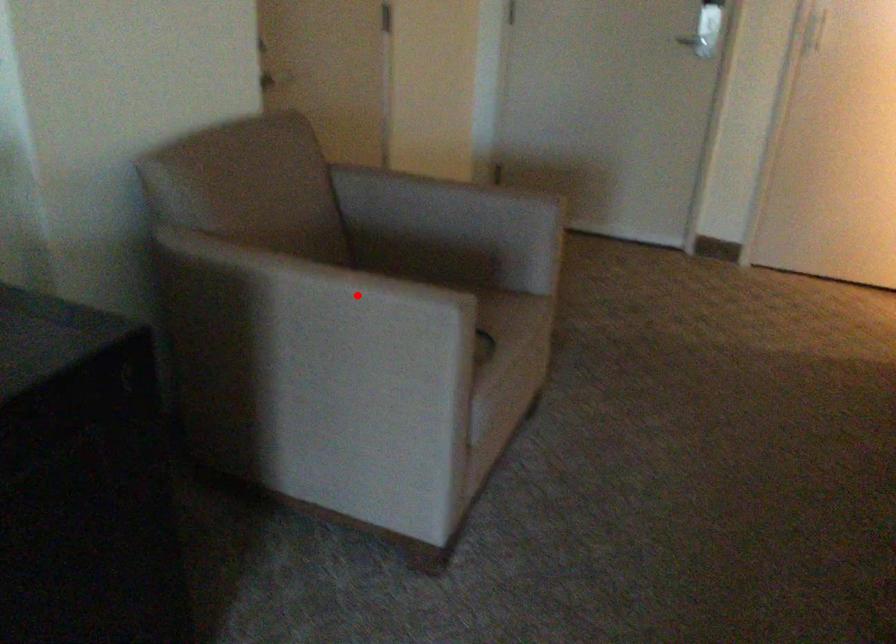
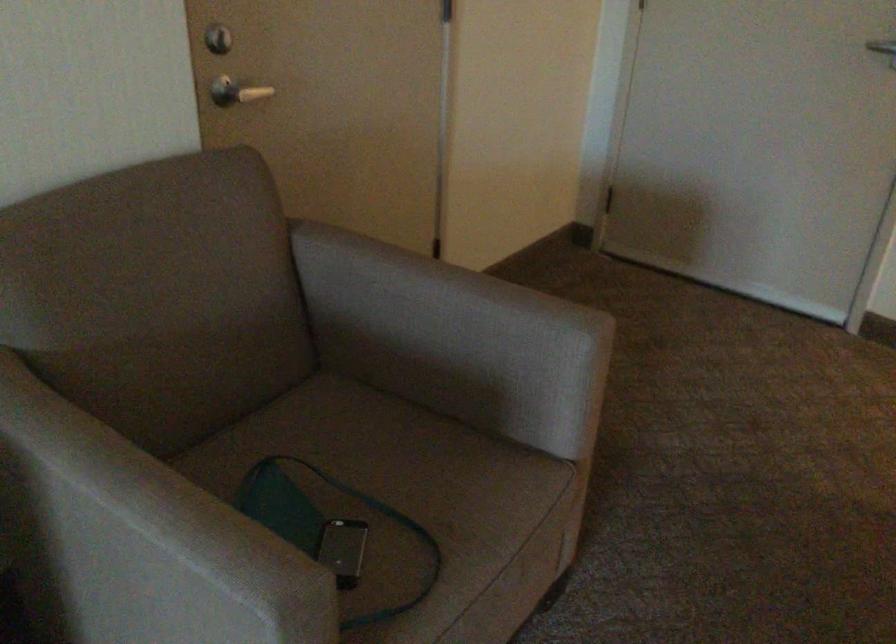
Find the pixel in the second image that matches the highlighted location in the first image.

(150, 538)